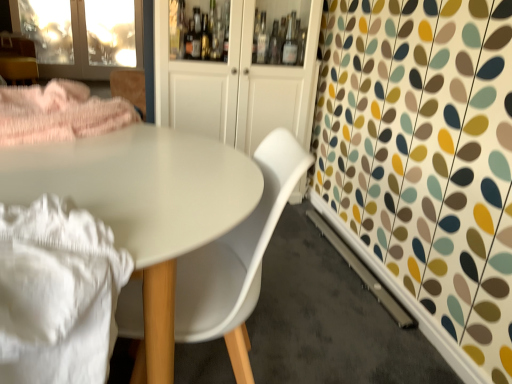
The width and height of the screenshot is (512, 384). In order to click on white matte chair at center in this screenshot , I will do `click(237, 260)`.

What do you see at coordinates (144, 204) in the screenshot? I see `matte white table at center` at bounding box center [144, 204].

The height and width of the screenshot is (384, 512). What are the coordinates of `white cotton blanket at lower left` in the screenshot? It's located at (57, 293).

This screenshot has height=384, width=512. I want to click on matte pink fabric at upper left, so click(18, 68).

The image size is (512, 384). Describe the element at coordinates (77, 52) in the screenshot. I see `transparent glass screen door at upper left` at that location.

What do you see at coordinates (236, 85) in the screenshot? I see `white glossy cabinet at center` at bounding box center [236, 85].

The height and width of the screenshot is (384, 512). In order to click on white matte chair at center in this screenshot , I will do `click(237, 260)`.

How much distance is there between matte white table at center and transparent glass screen door at upper left?

The distance of matte white table at center from transparent glass screen door at upper left is 11.63 feet.

From the picture: Is matte white table at center to the left or to the right of transparent glass screen door at upper left in the image?

Based on their positions, matte white table at center is located to the right of transparent glass screen door at upper left.

Is matte white table at center facing towards transparent glass screen door at upper left?

Yes.

Can you tell me how much matte white table at center and transparent glass screen door at upper left differ in facing direction?

The angle between the facing direction of matte white table at center and the facing direction of transparent glass screen door at upper left is 180 degrees.

Is matte white table at center a part of white cotton blanket at lower left?

Definitely not — matte white table at center is not inside white cotton blanket at lower left.

Considering the sizes of objects white cotton blanket at lower left and matte white table at center in the image provided, who is thinner, white cotton blanket at lower left or matte white table at center?

With smaller width is white cotton blanket at lower left.

Looking at this image, is white cotton blanket at lower left placed right next to matte white table at center?

No, white cotton blanket at lower left is not touching matte white table at center.

Is white cotton blanket at lower left to the left or to the right of matte white table at center in the image?

white cotton blanket at lower left is to the left of matte white table at center.

Which is in front, transparent glass screen door at upper left or white matte chair at center?

white matte chair at center is more forward.

Which is more to the right, transparent glass screen door at upper left or white matte chair at center?

From the viewer's perspective, white matte chair at center appears more on the right side.

Is transparent glass screen door at upper left turned away from white matte chair at center?

transparent glass screen door at upper left does not have its back to white matte chair at center.

Is point (82, 67) positioned after point (193, 268)?

That is True.

Which is farther from the camera, (7, 60) or (250, 304)?

The point (7, 60) is behind.

Is white matte chair at center at the back of matte pink fabric at upper left?

No, matte pink fabric at upper left is not facing away from white matte chair at center.

Considering their positions, is matte pink fabric at upper left located in front of or behind white matte chair at center?

Clearly, matte pink fabric at upper left is behind white matte chair at center.

Is matte white table at center positioned behind white matte chair at center?

No, it is in front of white matte chair at center.

Looking at their sizes, would you say matte white table at center is wider or thinner than white matte chair at center?

Considering their sizes, matte white table at center looks broader than white matte chair at center.

Considering the sizes of objects matte white table at center and white matte chair at center in the image provided, who is shorter, matte white table at center or white matte chair at center?

matte white table at center.

Could you tell me if matte white table at center is facing white matte chair at center?

No, matte white table at center is not aimed at white matte chair at center.

Does transparent glass screen door at upper left appear on the left side of matte pink fabric at upper left?

Indeed, transparent glass screen door at upper left is positioned on the left side of matte pink fabric at upper left.

Is transparent glass screen door at upper left turned away from matte pink fabric at upper left?

No, transparent glass screen door at upper left is not facing away from matte pink fabric at upper left.

Consider the image. Is transparent glass screen door at upper left completely or partially outside of matte pink fabric at upper left?

Yes, transparent glass screen door at upper left is outside of matte pink fabric at upper left.

Where is `blanket on the left of white matte chair at center`? blanket on the left of white matte chair at center is located at coordinates (57, 293).

How many degrees apart are the facing directions of white matte chair at center and white cotton blanket at lower left?

The angle between the facing direction of white matte chair at center and the facing direction of white cotton blanket at lower left is 90 degrees.

Is white matte chair at center behind white cotton blanket at lower left?

Yes.

From the image's perspective, does white matte chair at center appear lower than white cotton blanket at lower left?

Actually, white matte chair at center appears above white cotton blanket at lower left in the image.

This screenshot has height=384, width=512. Identify the location of table in front of the transparent glass screen door at upper left. (144, 204).

Locate an element on the screen. The height and width of the screenshot is (384, 512). table located on the right of white cotton blanket at lower left is located at coordinates (144, 204).

Looking at this image, considering their positions, is white cotton blanket at lower left positioned further to white matte chair at center than transparent glass screen door at upper left?

Based on the image, transparent glass screen door at upper left appears to be further to white matte chair at center.

Based on their spatial positions, is white glossy cabinet at center or matte pink fabric at upper left closer to white matte chair at center?

Among the two, white glossy cabinet at center is located nearer to white matte chair at center.

From the picture: From the image, which object appears to be nearer to white matte chair at center, matte white table at center or white glossy cabinet at center?

matte white table at center is closer to white matte chair at center.

Based on their spatial positions, is matte pink fabric at upper left or matte white table at center further from transparent glass screen door at upper left?

Among the two, matte white table at center is located further to transparent glass screen door at upper left.

Which object lies nearer to the anchor point white glossy cabinet at center, white matte chair at center or matte pink fabric at upper left?

white matte chair at center.

Estimate the real-world distances between objects in this image. Which object is further from white matte chair at center, transparent glass screen door at upper left or matte pink fabric at upper left?

transparent glass screen door at upper left.

Based on their spatial positions, is white matte chair at center or white glossy cabinet at center closer to white cotton blanket at lower left?

white matte chair at center.

Which object lies further to the anchor point matte pink fabric at upper left, matte white table at center or white cotton blanket at lower left?

white cotton blanket at lower left is further to matte pink fabric at upper left.

You are a GUI agent. You are given a task and a screenshot of the screen. Output one action in this format:
    pyautogui.click(x=<x>, y=<y>)
    Task: Click on the chair positioned between matte white table at center and transparent glass screen door at upper left from near to far
    The width and height of the screenshot is (512, 384).
    Given the screenshot: What is the action you would take?
    (237, 260)

Where is `dresser between white matte chair at center and transparent glass screen door at upper left along the z-axis`? The image size is (512, 384). dresser between white matte chair at center and transparent glass screen door at upper left along the z-axis is located at coordinates (236, 85).

In order to click on dresser located between white cotton blanket at lower left and transparent glass screen door at upper left in the depth direction in this screenshot , I will do `click(236, 85)`.

I want to click on side table between white matte chair at center and transparent glass screen door at upper left along the z-axis, so pyautogui.click(x=18, y=68).